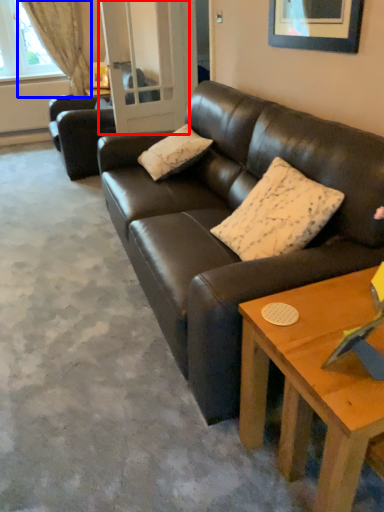
Question: Which object appears farthest to the camera in this image, glass door (highlighted by a red box) or curtain (highlighted by a blue box)?

Choices:
 (A) glass door
 (B) curtain

Answer: (B)